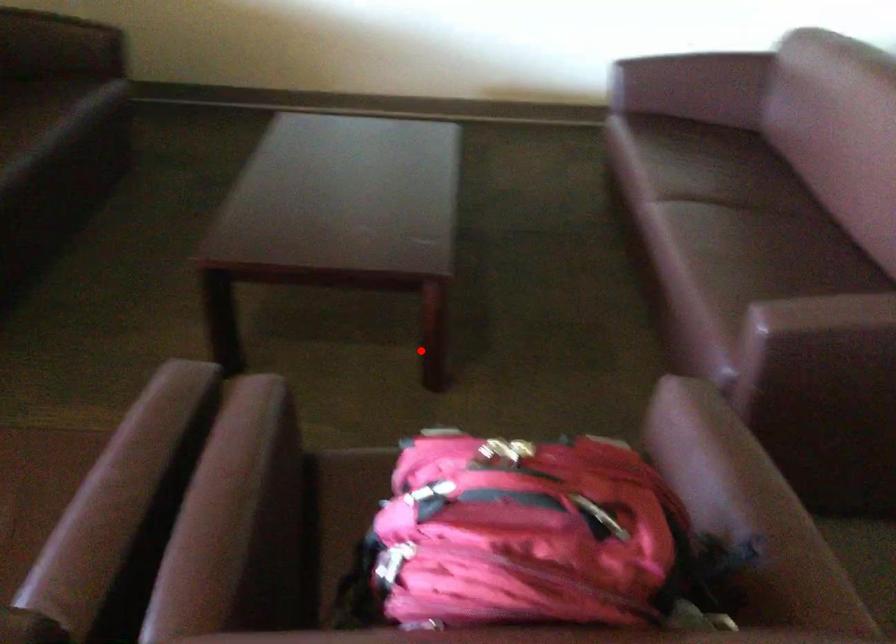
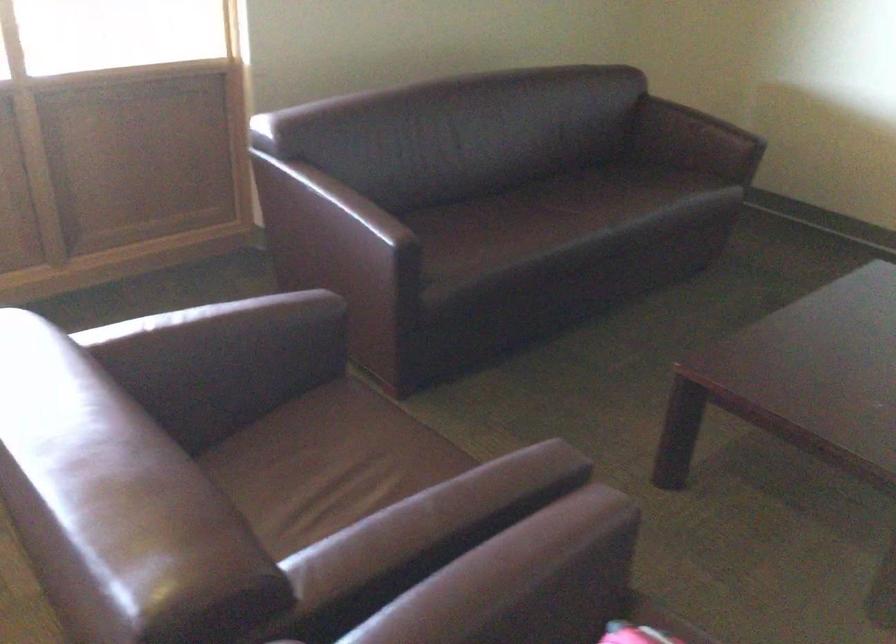
Locate, in the second image, the point that corresponds to the highlighted location in the first image.

(883, 569)